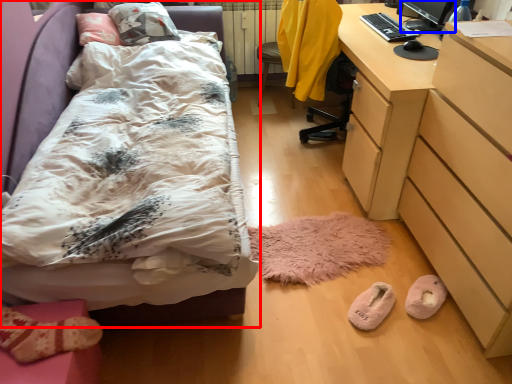
Question: Which object is further to the camera taking this photo, bed (highlighted by a red box) or computer monitor (highlighted by a blue box)?

Choices:
 (A) bed
 (B) computer monitor

Answer: (B)